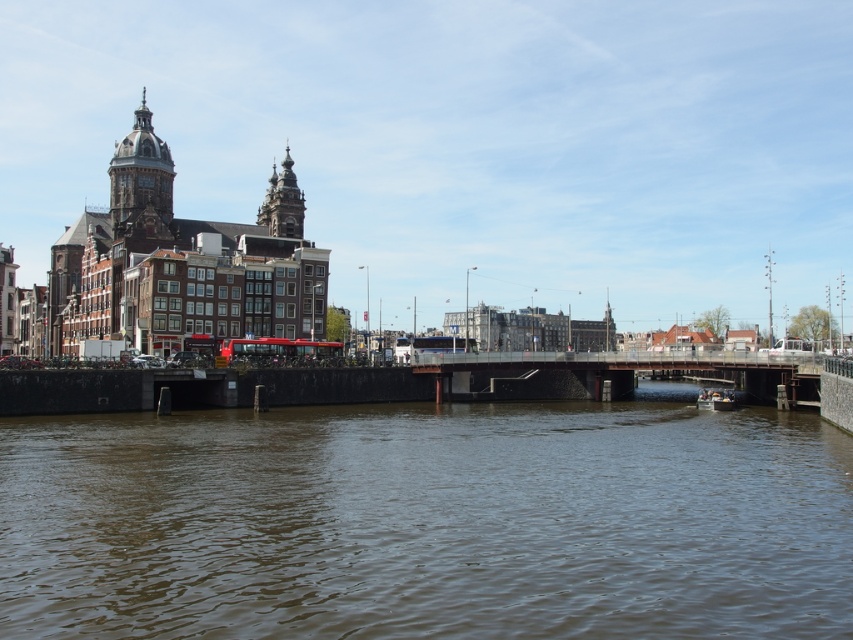
Question: Observing the image, what is the correct spatial positioning of matte gray dome at upper left in reference to smooth black boat at lower right?

Choices:
 (A) right
 (B) left

Answer: (B)

Question: Is golden stone tower at center behind smooth black boat at lower right?

Choices:
 (A) no
 (B) yes

Answer: (B)

Question: Estimate the real-world distances between objects in this image. Which object is closer to the golden stone tower at center?

Choices:
 (A) smooth black boat at lower right
 (B) red rubber bus at center

Answer: (B)

Question: Can you confirm if brown murky water at center is wider than red rubber bus at center?

Choices:
 (A) yes
 (B) no

Answer: (A)

Question: Which of the following is the closest to the observer?

Choices:
 (A) (135, 189)
 (B) (728, 403)
 (C) (671, 371)
 (D) (276, 173)

Answer: (B)

Question: Which point is farther to the camera?

Choices:
 (A) matte gray dome at upper left
 (B) red rubber bus at center

Answer: (A)